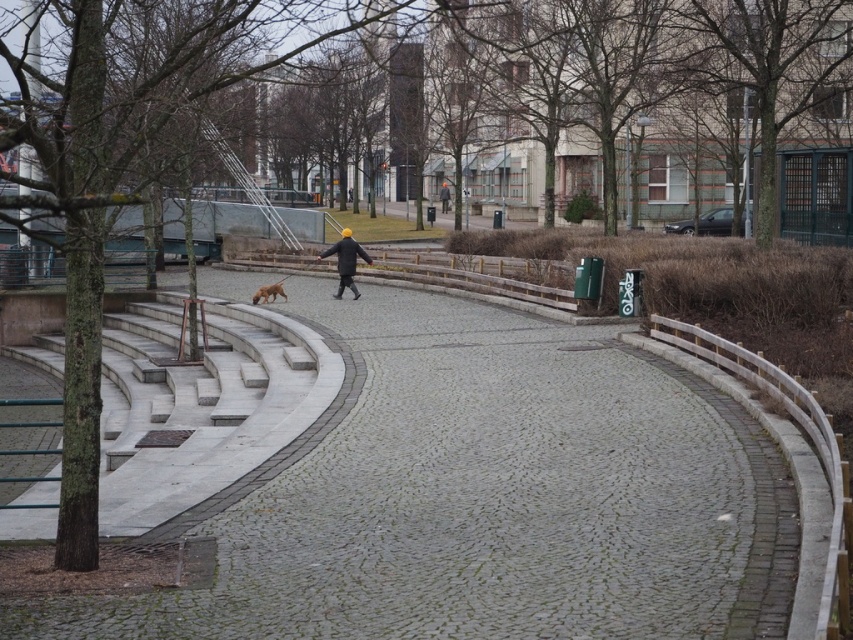
Between gray cobblestone pavement at center and brown fur dog at center, which one has more height?

Standing taller between the two is gray cobblestone pavement at center.

Does gray cobblestone pavement at center have a greater height compared to brown fur dog at center?

Correct, gray cobblestone pavement at center is much taller as brown fur dog at center.

Which is behind, point (424, 355) or point (276, 291)?

Point (276, 291)

The width and height of the screenshot is (853, 640). Identify the location of gray cobblestone pavement at center. (490, 497).

Looking at this image, does gray cobblestone pavement at center appear over white marble stairs at left?

Yes.

Measure the distance between gray cobblestone pavement at center and white marble stairs at left.

gray cobblestone pavement at center is 3.58 meters from white marble stairs at left.

Identify the location of gray cobblestone pavement at center. (490, 497).

Where is `gray cobblestone pavement at center`? gray cobblestone pavement at center is located at coordinates (490, 497).

From the picture: Which of these two, gray cobblestone pavement at center or matte black jacket at center, stands shorter?

With less height is matte black jacket at center.

What do you see at coordinates (490, 497) in the screenshot? This screenshot has height=640, width=853. I see `gray cobblestone pavement at center` at bounding box center [490, 497].

Identify the location of gray cobblestone pavement at center. (490, 497).